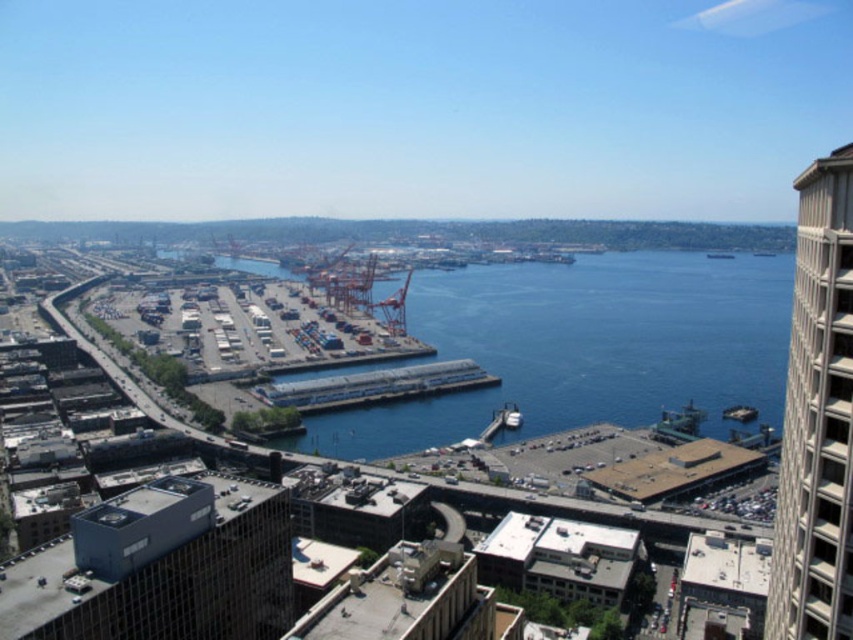
Does blue water at center lie behind white concrete dock at center?

No, it is not.

Find the location of a particular element. The height and width of the screenshot is (640, 853). blue water at center is located at coordinates pos(585,348).

Is white concrete dock at center positioned at the back of metallic silver boat at center?

That is True.

Who is more forward, [451,378] or [514,413]?

Point [514,413] is more forward.

Where is `white concrete dock at center`? This screenshot has width=853, height=640. white concrete dock at center is located at coordinates click(x=375, y=385).

Is point (755, 282) positioned before point (506, 408)?

That is False.

Does blue water at center have a greater width compared to metallic silver boat at center?

Indeed, blue water at center has a greater width compared to metallic silver boat at center.

Is point (691, 305) more distant than point (514, 404)?

Yes, it is behind point (514, 404).

The image size is (853, 640). Find the location of `blue water at center`. blue water at center is located at coordinates (585, 348).